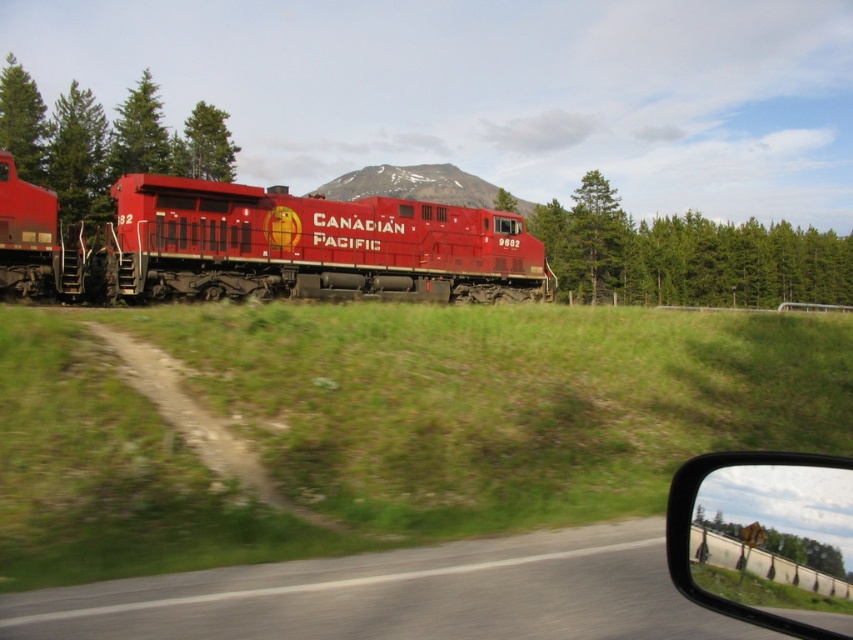
You are a photographer trying to capture the snowy mountain at upper center in your shot. However, you notice the clear plastic side mirror at lower right is blocking part of your view. Based on their positions, can you determine if the mirror is above or below the mountain?

The clear plastic side mirror at lower right is located below the snowy mountain at upper center, so the mirror is blocking the lower part of the mountain in your view.

You are a photographer trying to capture both the matte red locomotive at center and the green leafy tree at left in the same frame. Based on their sizes in the image, which object would require you to adjust your camera settings to focus on a wider area?

The matte red locomotive at center is wider than the green leafy tree at left, so you would need to adjust your camera settings to focus on a wider area to include the entire matte red locomotive at center in the frame.

You are a photographer trying to capture both the clear plastic side mirror at lower right and the snowy mountain at upper center in a single frame. Given that your camera has a 50mm lens, which has a field of view of approximately 46 degrees, can you fit both objects into the frame without moving your position?

The clear plastic side mirror at lower right and the snowy mountain at upper center are 290.41 feet apart from each other. However, without knowing the distance between the photographer and the objects, it is impossible to determine if they can fit within the 46 degree field of view of a 50mm lens.